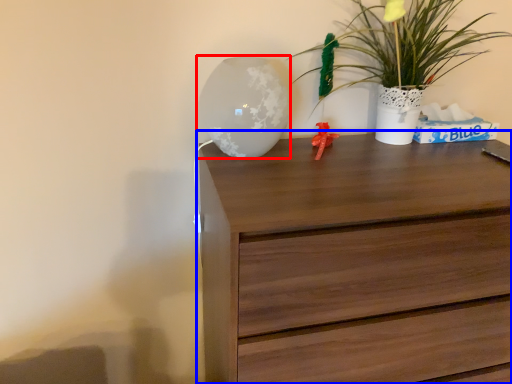
Question: Which object appears farthest to the camera in this image, table lamp (highlighted by a red box) or chest of drawers (highlighted by a blue box)?

Choices:
 (A) table lamp
 (B) chest of drawers

Answer: (A)